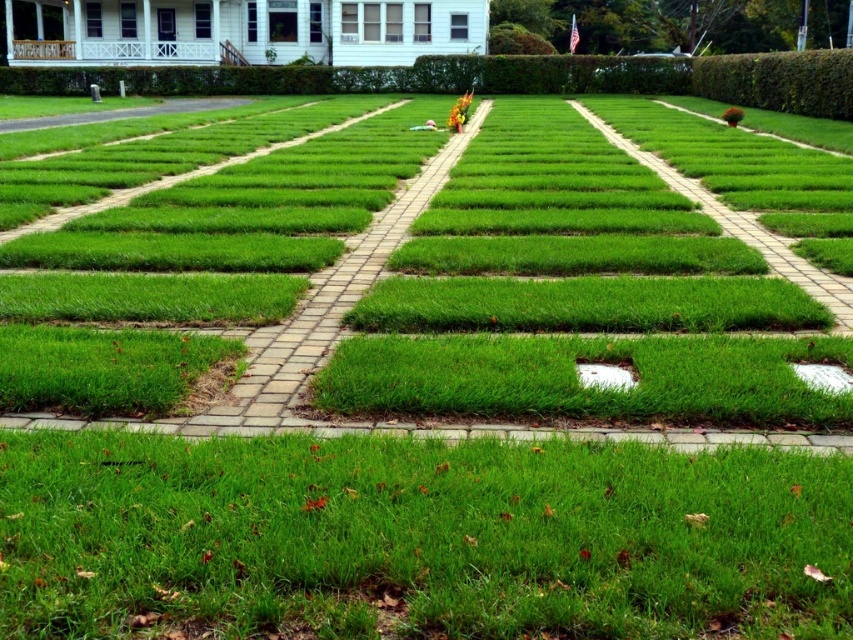
Question: Which object appears farthest from the camera in this image?

Choices:
 (A) white smooth patch at center
 (B) green grass at lower center
 (C) green leafy hedge at upper right
 (D) white matte patch at lower right

Answer: (C)

Question: Is green grass at lower center to the right of white smooth patch at center from the viewer's perspective?

Choices:
 (A) yes
 (B) no

Answer: (B)

Question: Among these points, which one is farthest from the camera?

Choices:
 (A) (709, 77)
 (B) (108, 60)
 (C) (134, 547)

Answer: (B)

Question: Which object appears farthest from the camera in this image?

Choices:
 (A) white painted wood porch at upper left
 (B) green grass at center
 (C) green leafy hedge at upper right
 (D) white matte patch at lower right

Answer: (A)

Question: Does green grass at center have a lesser width compared to white painted wood porch at upper left?

Choices:
 (A) yes
 (B) no

Answer: (A)

Question: Does white smooth patch at center have a greater width compared to white matte patch at lower right?

Choices:
 (A) yes
 (B) no

Answer: (B)